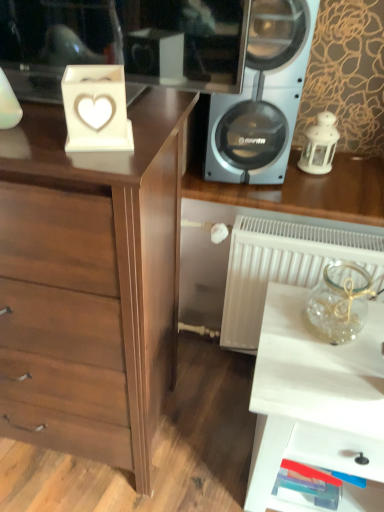
The height and width of the screenshot is (512, 384). I want to click on free spot above white glossy table at lower right (from a real-world perspective), so click(328, 345).